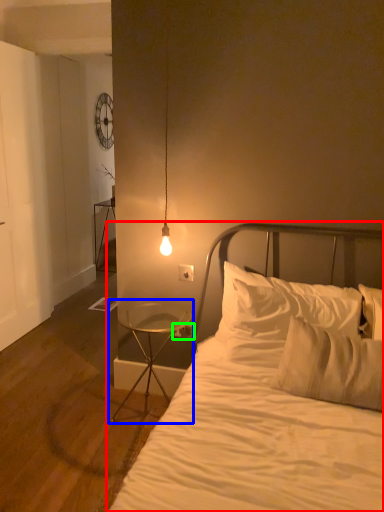
Question: Which is farther away from bed (highlighted by a red box)? nightstand (highlighted by a blue box) or electric outlet (highlighted by a green box)?

Choices:
 (A) nightstand
 (B) electric outlet

Answer: (B)